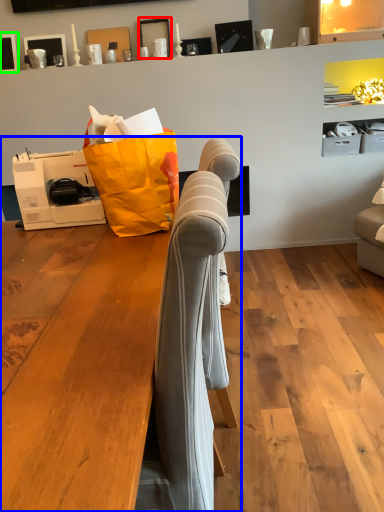
Question: Which object is positioned closest to picture frame (highlighted by a red box)? Select from furniture (highlighted by a blue box) and picture frame (highlighted by a green box).

Choices:
 (A) furniture
 (B) picture frame

Answer: (B)